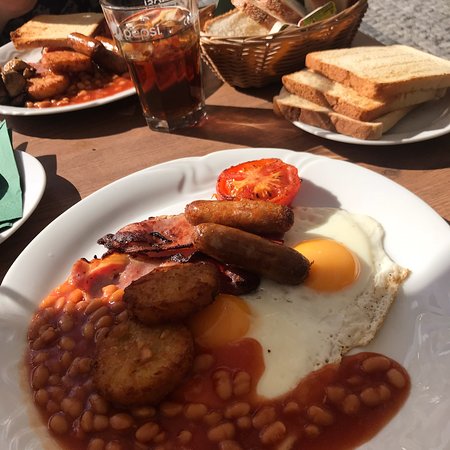
At what (x,y) coordinates should I click in order to perform the action: click on plate. Please return your answer as a coordinate pair (x, y). The width and height of the screenshot is (450, 450). Looking at the image, I should click on (32, 169), (357, 201), (422, 138).